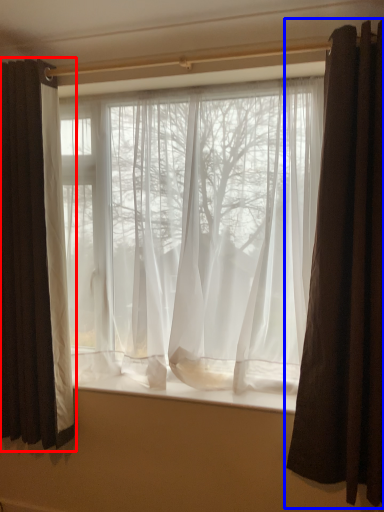
Question: Which object appears closest to the camera in this image, curtain (highlighted by a red box) or curtain (highlighted by a blue box)?

Choices:
 (A) curtain
 (B) curtain

Answer: (B)